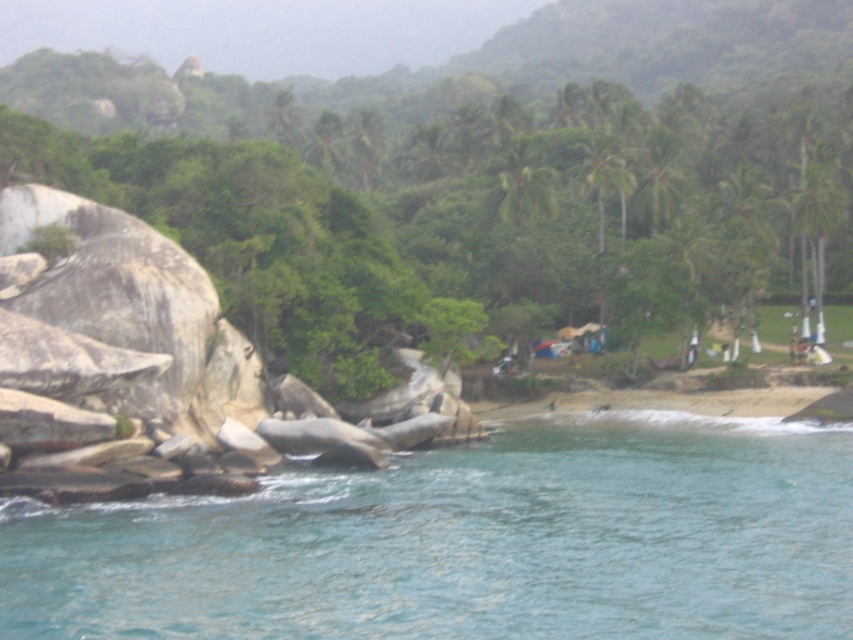
You are standing at the point marked by the coordinates point (469,541). Looking around, you see clear blue water at lower left. Which direction should you walk to reach the rocky shoreline in the middle ground?

The rocky shoreline in the middle ground is located in the opposite direction from the clear blue water at lower left. Since you are at point (469,541), you should walk towards the upper right to reach the rocky shoreline in the middle ground.

You are standing at the shoreline looking out at the beach area. There are two points marked in the scene. The first point is at coordinate (830, 195) and the second at (505, 170). Which point is closer to you?

Point (830, 195) is closer to the camera than point (505, 170), so the first point is closer to you.

You are standing on the beach and see the clear blue water at lower left and the green leafy palm tree at upper right. Which object is taller when viewed from your position?

The green leafy palm tree at upper right is taller than the clear blue water at lower left.